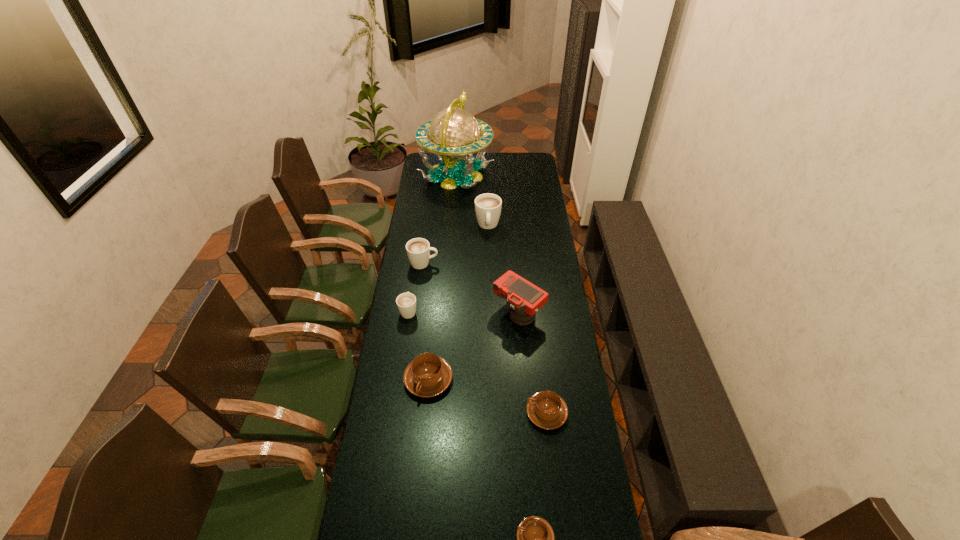
Find the location of a particular element. the farthest object is located at coordinates (454, 133).

The width and height of the screenshot is (960, 540). In order to click on globe in this screenshot , I will do `click(454, 133)`.

This screenshot has height=540, width=960. Identify the location of camera. (524, 298).

This screenshot has width=960, height=540. Identify the location of the second farthest object. click(488, 206).

Identify the location of the rightmost white cappuccino. Image resolution: width=960 pixels, height=540 pixels. (488, 206).

You are a GUI agent. You are given a task and a screenshot of the screen. Output one action in this format:
    pyautogui.click(x=<x>, y=<y>)
    Task: Click on the fifth nearest cappuccino
    The height and width of the screenshot is (540, 960).
    Given the screenshot: What is the action you would take?
    pyautogui.click(x=418, y=249)

Find the location of a particular element. The height and width of the screenshot is (540, 960). the sixth nearest object is located at coordinates (418, 249).

You are a GUI agent. You are given a task and a screenshot of the screen. Output one action in this format:
    pyautogui.click(x=<x>, y=<y>)
    Task: Click on the leftmost brown cappuccino
    The width and height of the screenshot is (960, 540).
    Given the screenshot: What is the action you would take?
    pyautogui.click(x=428, y=375)

At what (x,y) coordinates should I click in order to perform the action: click on the smallest white cappuccino. Please return your answer as a coordinate pair (x, y). Looking at the image, I should click on (406, 302).

This screenshot has width=960, height=540. Find the location of `the fourth nearest cappuccino`. the fourth nearest cappuccino is located at coordinates (406, 302).